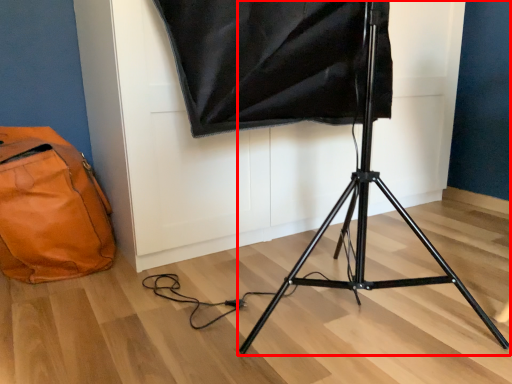
Question: Considering the relative positions of tripod (annotated by the red box) and bag in the image provided, where is tripod (annotated by the red box) located with respect to the staircase?

Choices:
 (A) right
 (B) left

Answer: (A)